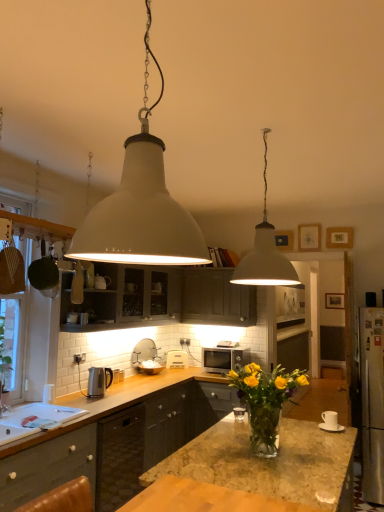
Where is `vacant space underneath polished stainless steel kettle at lower left, the 2th appliance positioned from the bottom (from a real-world perspective)`? vacant space underneath polished stainless steel kettle at lower left, the 2th appliance positioned from the bottom (from a real-world perspective) is located at coordinates (108, 393).